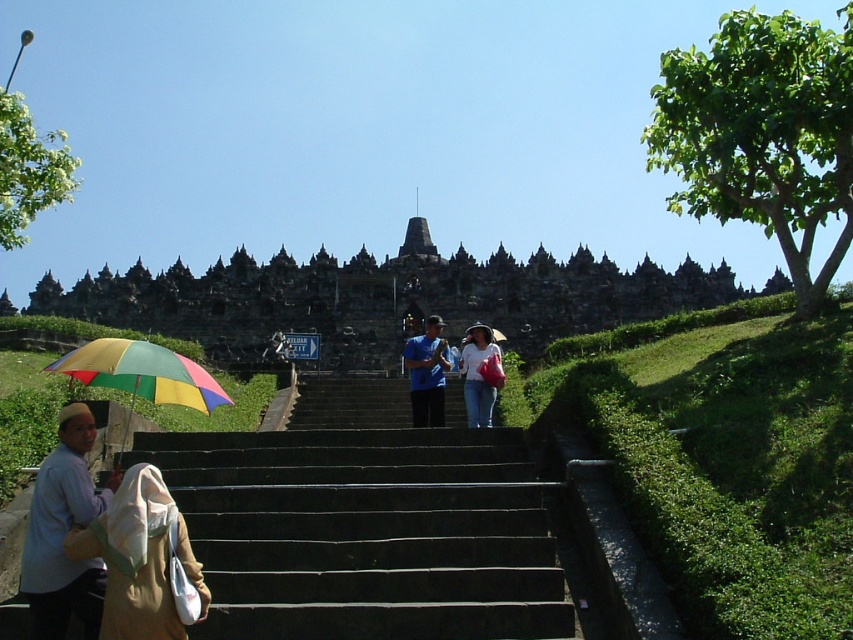
You are standing at the bottom of the stone steps leading up to the monument and notice the green grassy hill at lower right and the light brown fabric at lower left. Which object is positioned higher up on the steps?

The green grassy hill at lower right is positioned higher up on the steps than the light brown fabric at lower left because it is above it.

You are standing at the base of the dark gray stone temple at center and want to reach the entrance located at the top of its steps. Given that the temple is 116.81 meters away from you, and you can walk at a speed of 1.5 meters per second, how many minutes will it take you to reach the entrance?

The dark gray stone temple at center is 116.81 meters away from the viewer. At a walking speed of 1.5 meters per second, it would take approximately 77.87 seconds, which is roughly 1.298 minutes, to reach the entrance.

You are planning to set up a picnic blanket for a family gathering. You have two options for locations in the scene described. The first is the green grassy hill at lower right, and the second is the light brown fabric at lower left. Based on the spatial details provided, which location offers more horizontal space for spreading out the picnic blanket?

The green grassy hill at lower right offers more horizontal space for spreading out the picnic blanket because its width is larger than the light brown fabric at lower left.